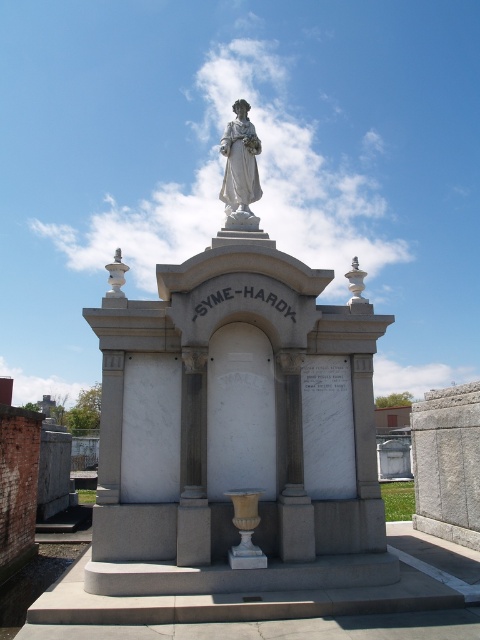
Who is taller, white marble statue at center or white marble statue at upper center?

white marble statue at center

Who is positioned more to the left, white marble statue at center or white marble statue at upper center?

Positioned to the left is white marble statue at upper center.

Which is in front, point (315, 540) or point (241, 164)?

Point (315, 540) is more forward.

The height and width of the screenshot is (640, 480). What are the coordinates of `white marble statue at center` in the screenshot? It's located at (237, 419).